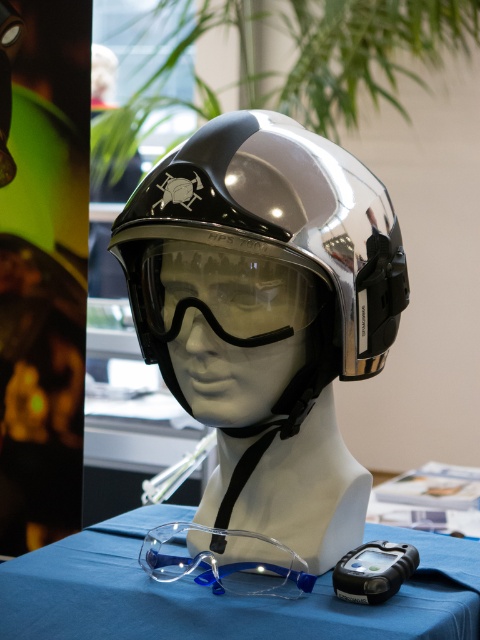
You are a safety inspector checking the equipment layout. You notice two protective eyewear items on the table in front of the mannequin head. Which one is positioned lower between the clear plastic safety glasses at lower center and the transparent plastic goggles at lower center?

The clear plastic safety glasses at lower center is located below the transparent plastic goggles at lower center, so it is positioned lower.

You are an inspector checking safety equipment. You see the shiny metallic helmet at center and the transparent plastic goggles at lower center. Which item is positioned to the right side?

The shiny metallic helmet at center is positioned to the right of the transparent plastic goggles at lower center.